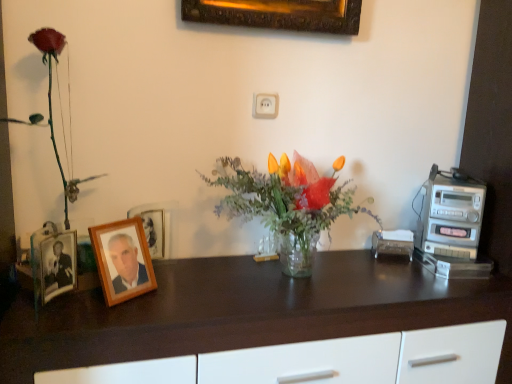
This screenshot has width=512, height=384. What are the coordinates of `free location to the right of wooden photo frame at left, the first picture frame when ordered from front to back` in the screenshot? It's located at (180, 300).